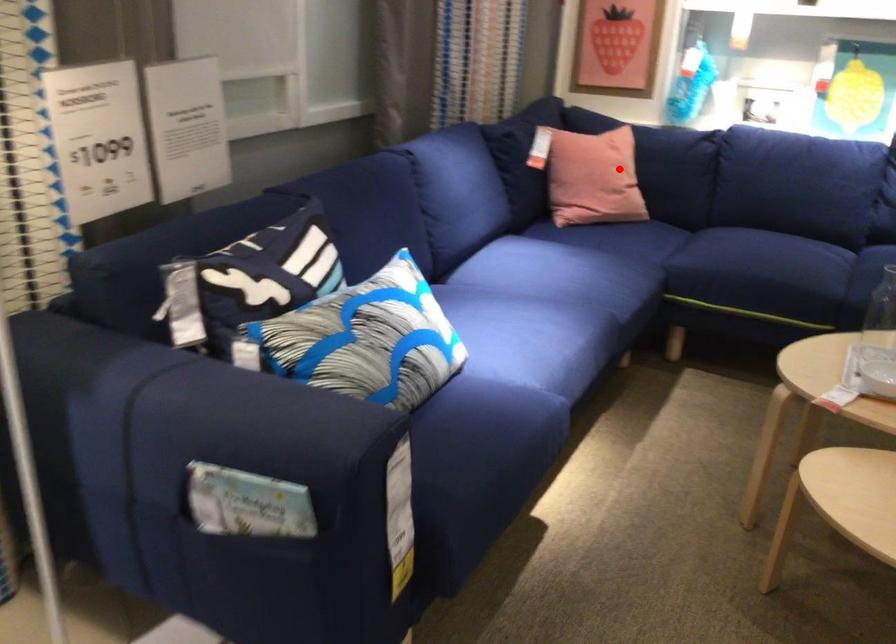
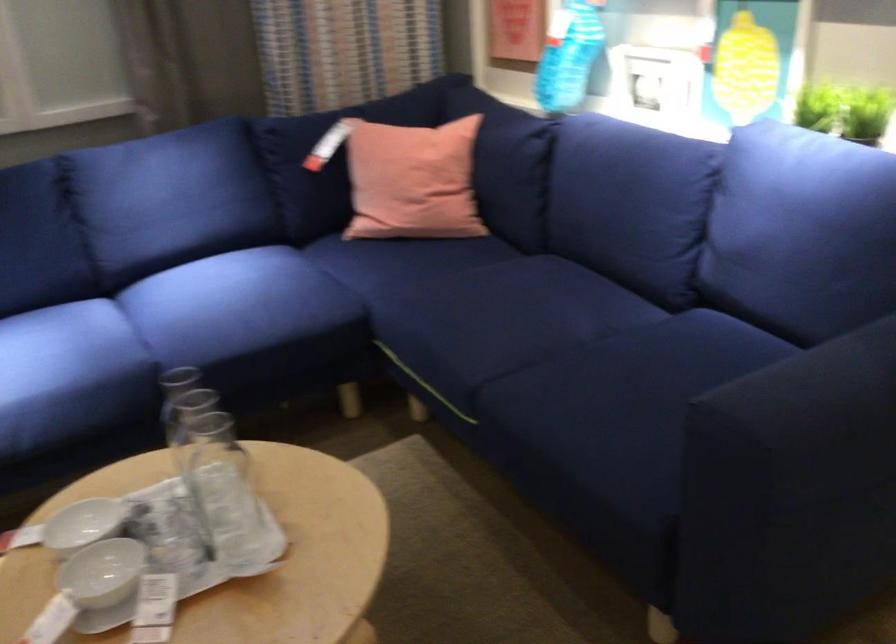
Question: A red point is marked in image1. In image2, is the corresponding 3D point closer to the camera or farther? Reply with the corresponding letter.

Choices:
 (A) The corresponding 3D point is closer.
 (B) The corresponding 3D point is farther.

Answer: (A)